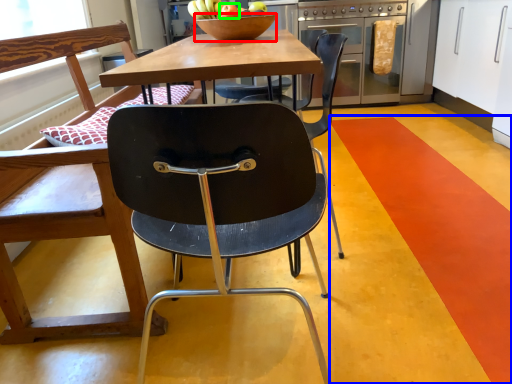
Question: Based on their relative distances, which object is farther from bowl (highlighted by a red box)? Choose from stripe (highlighted by a blue box) and apple (highlighted by a green box).

Choices:
 (A) stripe
 (B) apple

Answer: (A)